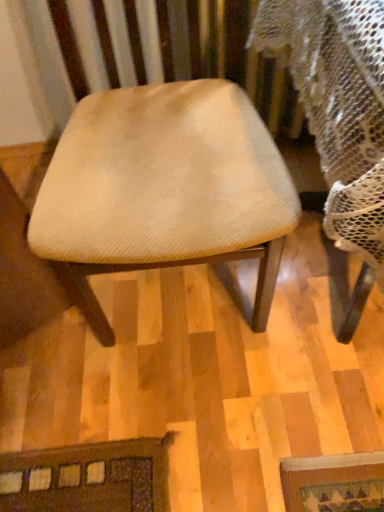
Image resolution: width=384 pixels, height=512 pixels. Identify the location of woven fabric chair at center. (163, 190).

What do you see at coordinates (163, 190) in the screenshot? I see `woven fabric chair at center` at bounding box center [163, 190].

In the scene shown: Measure the distance between woven fabric chair at center and camera.

woven fabric chair at center and camera are 26.68 inches apart from each other.

Find the location of a particular element. This screenshot has width=384, height=512. woven fabric chair at center is located at coordinates (163, 190).